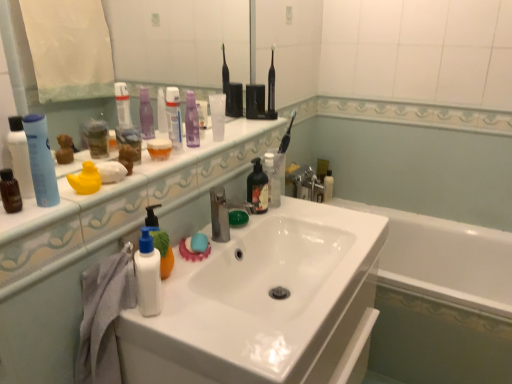
Image resolution: width=512 pixels, height=384 pixels. What are the coordinates of `free space to the back side of translucent rubber soap at sink` in the screenshot? It's located at (210, 232).